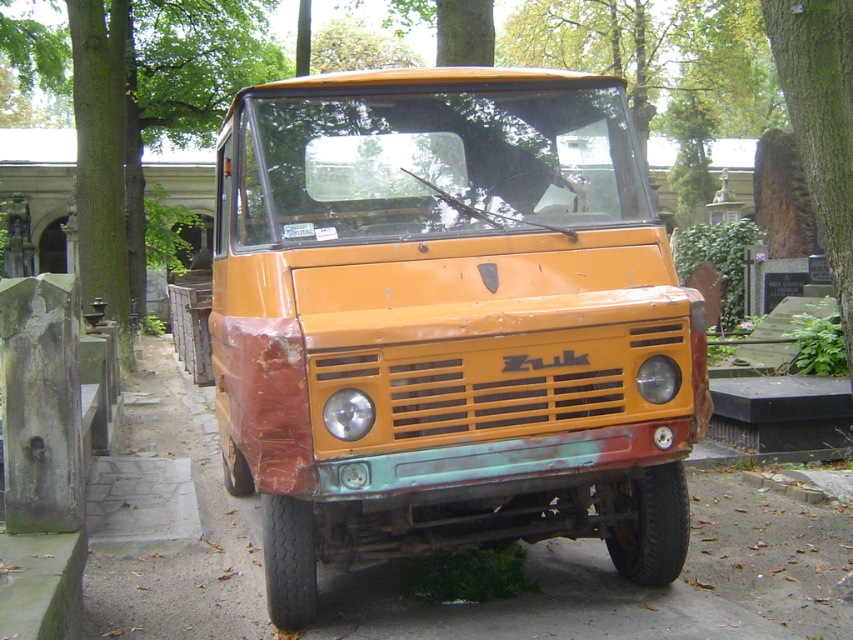
Question: Observing the image, what is the correct spatial positioning of rusty orange truck at center in reference to green rough bark tree at left?

Choices:
 (A) below
 (B) above

Answer: (A)

Question: Can you confirm if rusty orange truck at center is smaller than green rough bark tree at left?

Choices:
 (A) yes
 (B) no

Answer: (A)

Question: Which point is farther to the camera?

Choices:
 (A) (224, 72)
 (B) (399, 83)
 (C) (781, 609)

Answer: (A)

Question: Which of these objects is positioned closest to the green rough bark tree at left?

Choices:
 (A) smooth concrete pavement at center
 (B) rusty orange truck at center

Answer: (A)

Question: Which point is closer to the camera?

Choices:
 (A) (207, 67)
 (B) (212, 579)
 (C) (444, 125)

Answer: (C)

Question: Is rusty orange truck at center bigger than green rough bark tree at left?

Choices:
 (A) no
 (B) yes

Answer: (A)